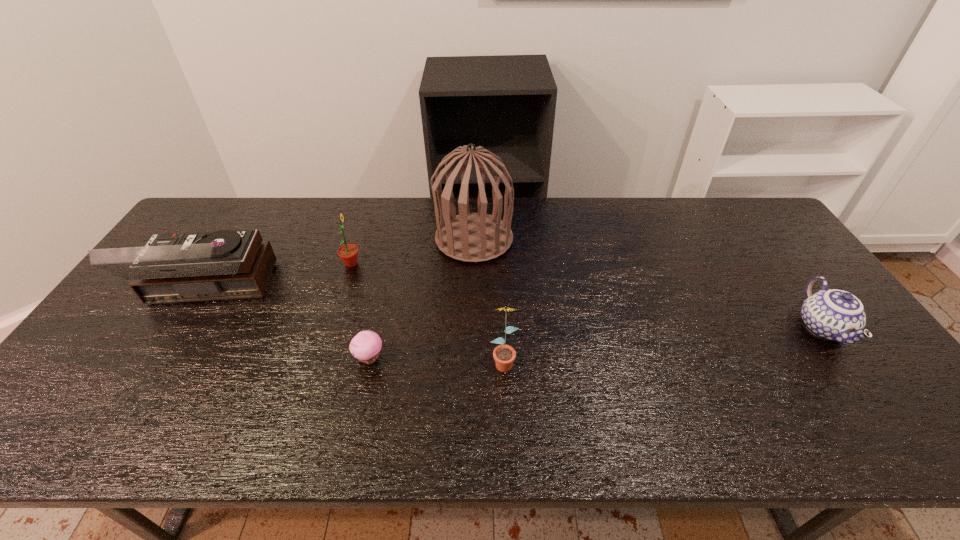
The height and width of the screenshot is (540, 960). What are the coordinates of `vacant space located 0.390m on the right of the birdcage` in the screenshot? It's located at (632, 239).

Find the location of `vacant area situated 0.210m on the back of the second tallest object`. vacant area situated 0.210m on the back of the second tallest object is located at coordinates (253, 219).

This screenshot has width=960, height=540. I want to click on vacant space located 0.050m on the face of the second object from left to right, so click(x=377, y=264).

This screenshot has width=960, height=540. What are the coordinates of `free space located 0.070m on the flower of the nearer sunflower` in the screenshot? It's located at (505, 401).

At what (x,y) coordinates should I click in order to perform the action: click on free location located 0.100m from the spout of the fifth tallest object. Please return your answer as a coordinate pair (x, y). The image size is (960, 540). Looking at the image, I should click on (872, 397).

In order to click on free space located 0.130m on the front of the shortest object in this screenshot , I will do tap(356, 421).

You are a GUI agent. You are given a task and a screenshot of the screen. Output one action in this format:
    pyautogui.click(x=<x>, y=<y>)
    Task: Click on the object located in the far edge section of the desktop
    
    Given the screenshot: What is the action you would take?
    pyautogui.click(x=470, y=237)

The height and width of the screenshot is (540, 960). Identify the location of object present at the left edge. (226, 264).

Locate an element on the screen. object located at the right edge is located at coordinates (836, 315).

At what (x,y) coordinates should I click in order to perform the action: click on free location at the far edge of the desktop. Please return your answer as a coordinate pair (x, y). The width and height of the screenshot is (960, 540). Looking at the image, I should click on (673, 233).